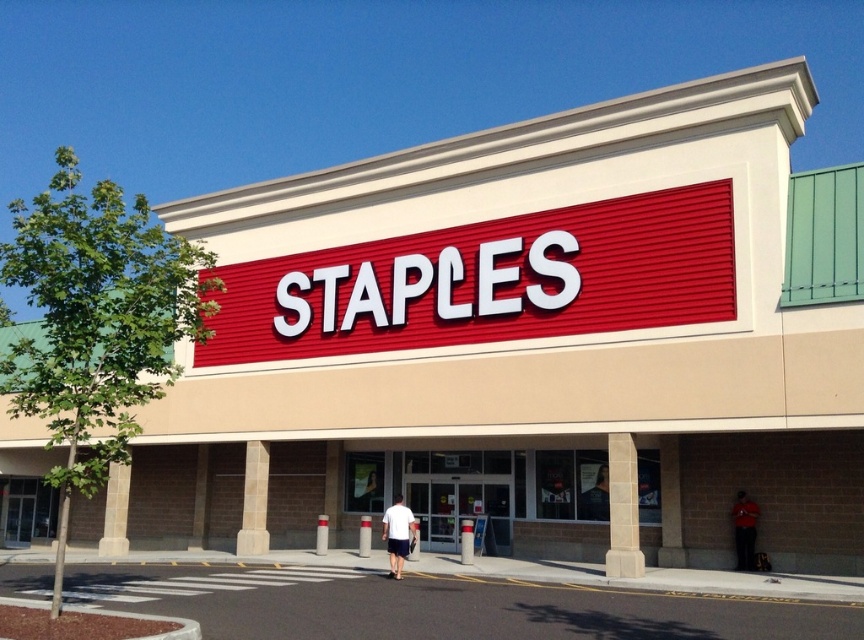
Question: Which of the following is the farthest from the observer?

Choices:
 (A) (742, 508)
 (B) (410, 548)

Answer: (A)

Question: Which is farther from the white matte shirt at center?

Choices:
 (A) smooth black shirt at lower center
 (B) red shirt at lower right

Answer: (B)

Question: Which point is farther to the camera?

Choices:
 (A) smooth black shirt at lower center
 (B) white matte shirt at center

Answer: (A)

Question: Is white matte shirt at center positioned in front of smooth black shirt at lower center?

Choices:
 (A) no
 (B) yes

Answer: (B)

Question: Does white matte shirt at center have a smaller size compared to red shirt at lower right?

Choices:
 (A) no
 (B) yes

Answer: (B)

Question: Can you confirm if white matte shirt at center is thinner than red shirt at lower right?

Choices:
 (A) no
 (B) yes

Answer: (B)